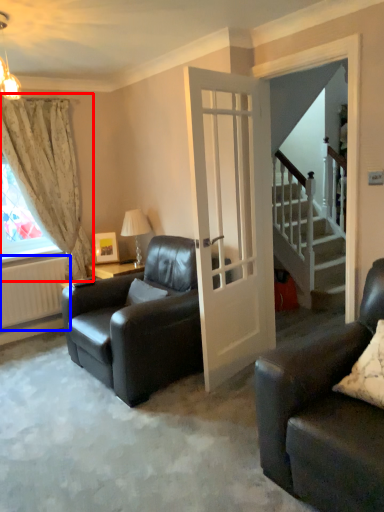
Question: Which object is further to the camera taking this photo, curtain (highlighted by a red box) or radiator (highlighted by a blue box)?

Choices:
 (A) curtain
 (B) radiator

Answer: (B)